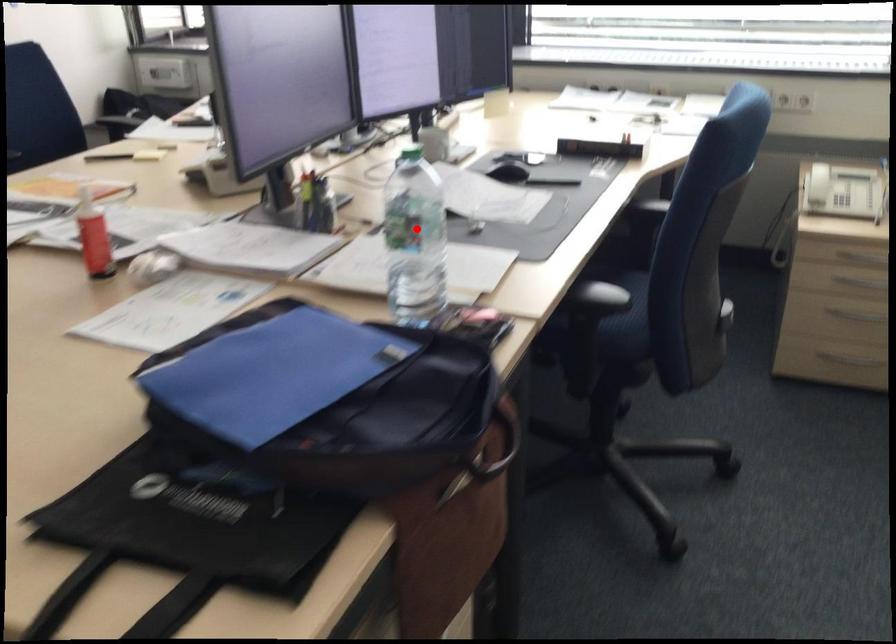
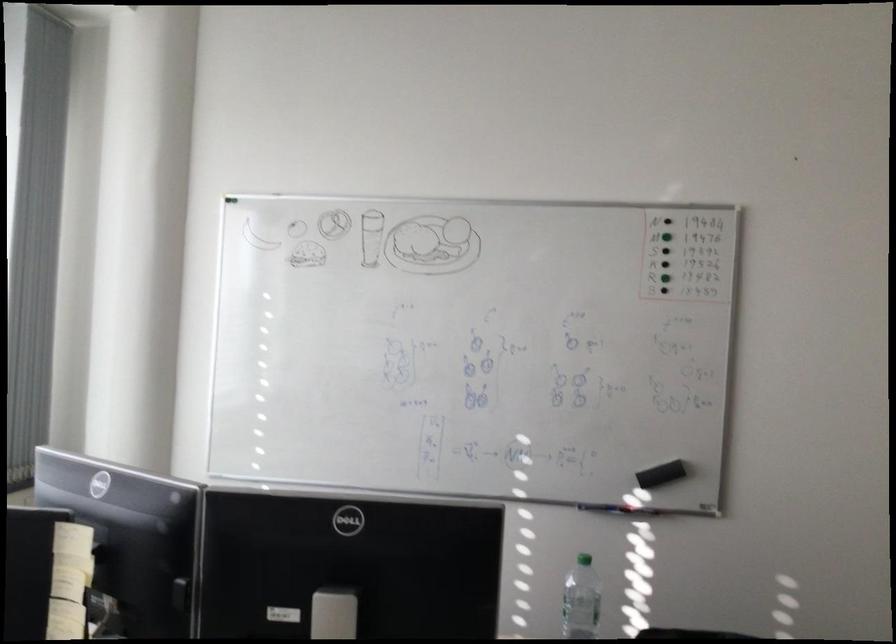
Question: I am providing you with two images of the same scene from different viewpoints. A red point is shown in image1. For the corresponding object point in image2, is it positioned nearer or farther from the camera?

Choices:
 (A) Nearer
 (B) Farther

Answer: (B)